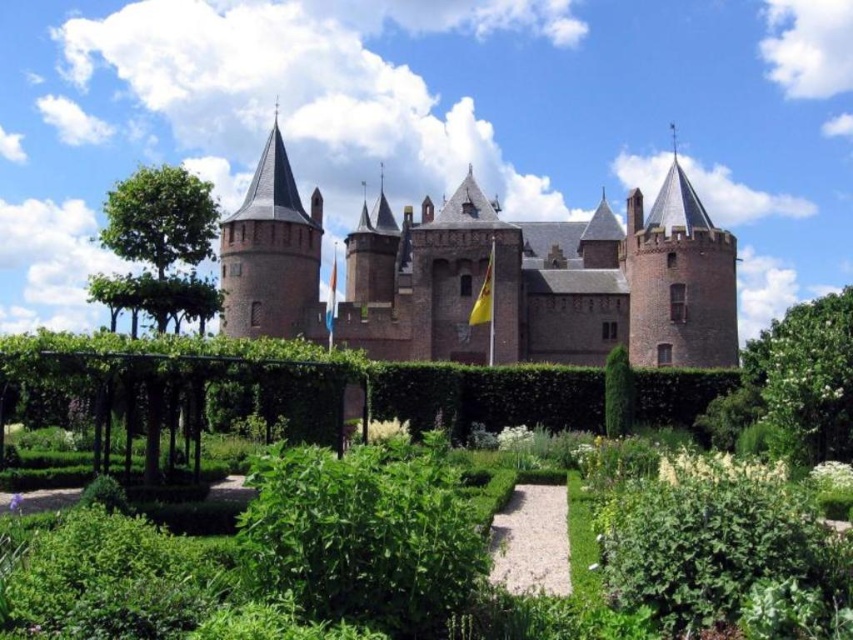
Who is positioned more to the right, green leafy bush at right or brick tower at center-left?

From the viewer's perspective, green leafy bush at right appears more on the right side.

Locate an element on the screen. This screenshot has height=640, width=853. green leafy bush at right is located at coordinates (793, 384).

You are a GUI agent. You are given a task and a screenshot of the screen. Output one action in this format:
    pyautogui.click(x=<x>, y=<y>)
    Task: Click on the green leafy bush at right
    The width and height of the screenshot is (853, 640).
    Given the screenshot: What is the action you would take?
    pyautogui.click(x=793, y=384)

Measure the distance between point (106, 573) and camera.

They are 52.14 meters apart.

Is point (299, 586) positioned before point (288, 404)?

That is True.

Find the location of `green leafy hedge at lower center`. green leafy hedge at lower center is located at coordinates (289, 570).

Does green leafy bush at right appear under green leafy tree at left?

Yes.

Does green leafy bush at right come behind green leafy tree at left?

Yes.

Measure the distance between point (843, 362) and camera.

Point (843, 362) is 76.35 meters from camera.

Identify the location of green leafy bush at right. (793, 384).